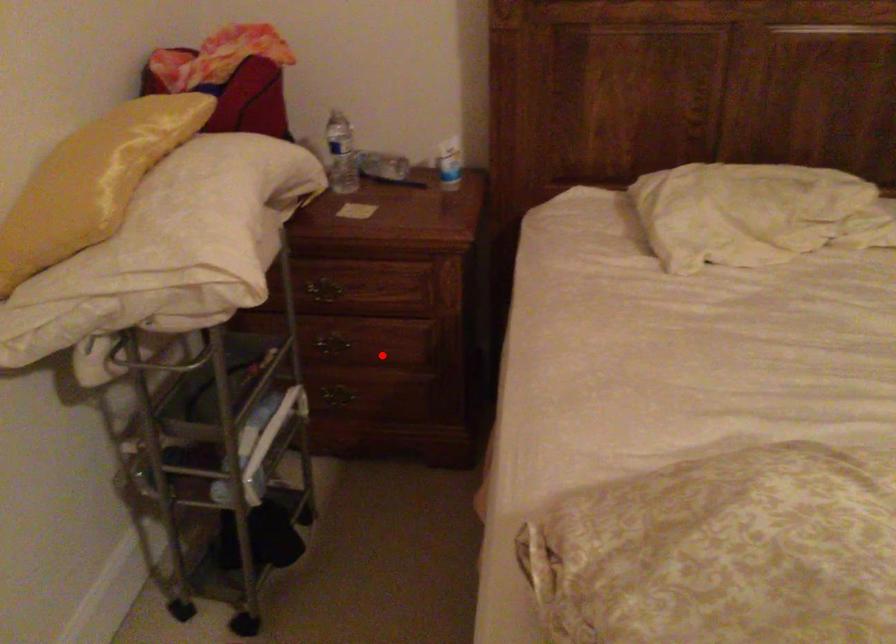
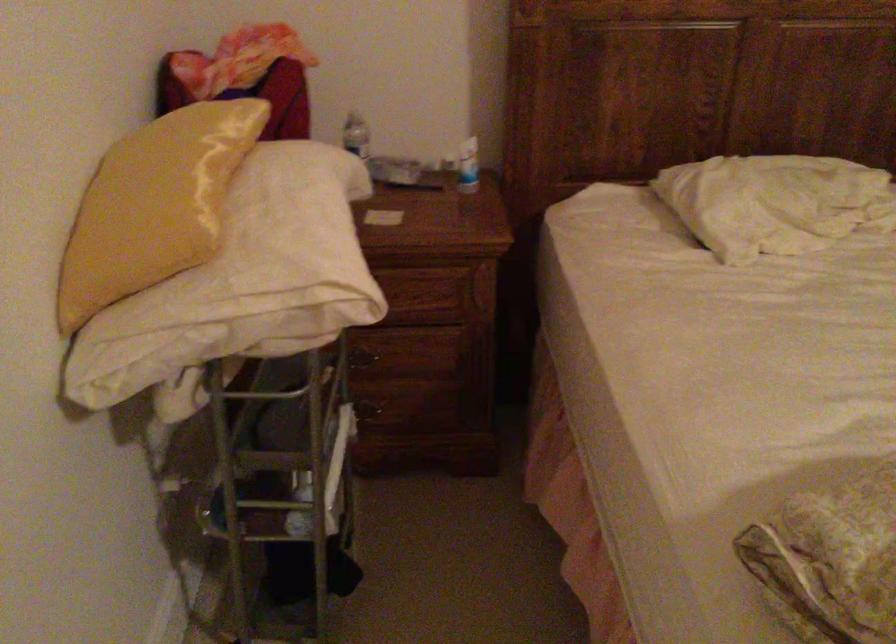
Locate, in the second image, the point that corresponds to the highlighted location in the first image.

(412, 365)